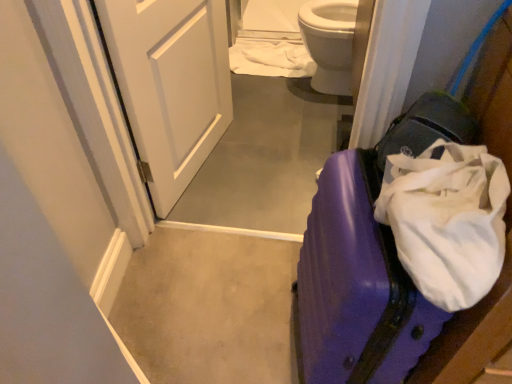
Question: Is white glossy door at upper left in front of or behind white fabric at upper center in the image?

Choices:
 (A) front
 (B) behind

Answer: (A)

Question: Considering the relative positions of white glossy door at upper left and white fabric at upper center in the image provided, is white glossy door at upper left to the left or to the right of white fabric at upper center?

Choices:
 (A) left
 (B) right

Answer: (A)

Question: Considering the real-world distances, which object is farthest from the purple glossy suitcase at lower right?

Choices:
 (A) white fabric at upper center
 (B) white glossy door at upper left

Answer: (A)

Question: Which object is positioned closest to the white fabric at upper center?

Choices:
 (A) purple glossy suitcase at lower right
 (B) white glossy door at upper left

Answer: (B)